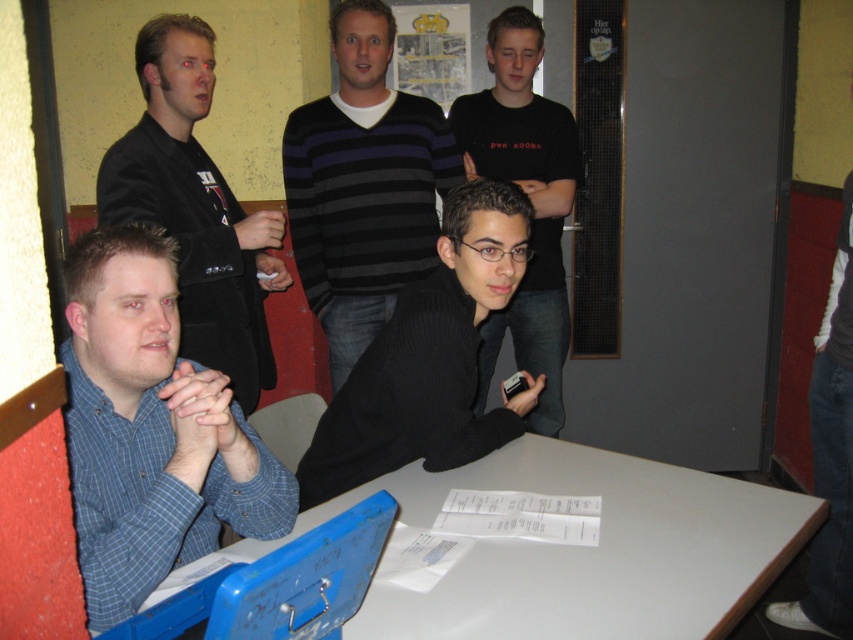
Question: Considering the real-world distances, which object is farthest from the blue checkered shirt at left?

Choices:
 (A) matte black jacket at left
 (B) white glossy table at lower center
 (C) black ribbed sweater at center
 (D) striped sweater at center

Answer: (D)

Question: Among these points, which one is nearest to the camera?

Choices:
 (A) (126, 184)
 (B) (610, 524)
 (C) (128, 396)
 (D) (442, 228)

Answer: (C)

Question: Is striped sweater at center bigger than matte black jacket at left?

Choices:
 (A) no
 (B) yes

Answer: (A)

Question: Which object is the farthest from the blue checkered shirt at left?

Choices:
 (A) black ribbed sweater at center
 (B) matte black jacket at left
 (C) black matte shirt at center

Answer: (C)

Question: Is blue checkered shirt at left bigger than striped sweater at center?

Choices:
 (A) no
 (B) yes

Answer: (A)

Question: Is white glossy table at lower center wider than blue checkered shirt at left?

Choices:
 (A) yes
 (B) no

Answer: (A)